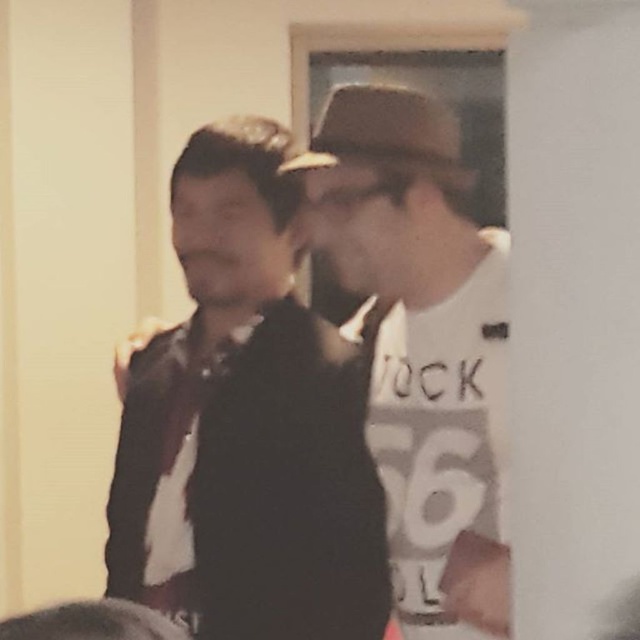
You are standing in the room and see a point at coordinates (x=412, y=243). Which object is this point located on?

The point at coordinates (x=412, y=243) is located on the white matte t shirt at center.

You are standing in the room and want to move from the point at coordinates point (259, 536) to the point at coordinates point (392, 380). Which direction should you move in to reach your destination?

To move from point (259, 536) to point (392, 380), you should move towards the upper left direction since the destination point is located at a higher y coordinate and lower x coordinate compared to the starting point.